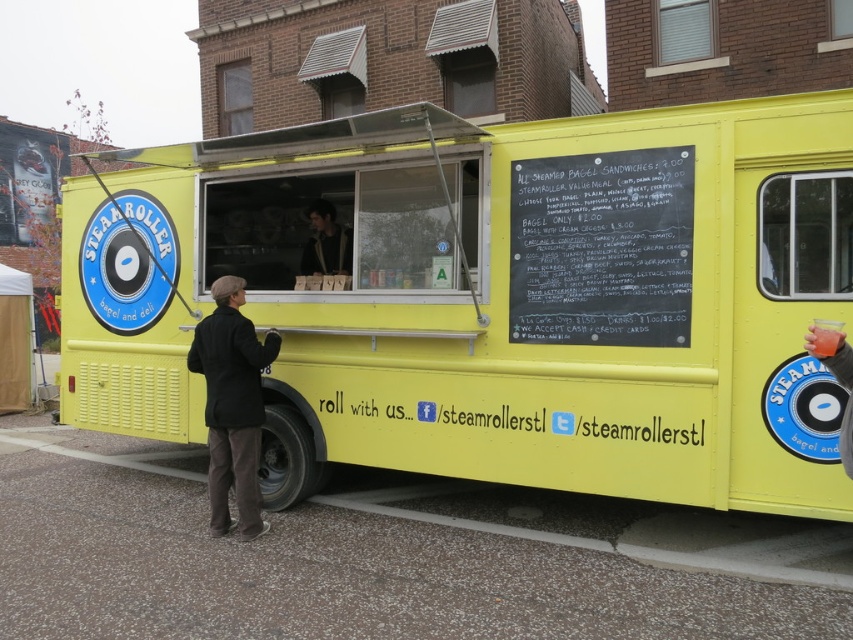
What do you see at coordinates (602, 248) in the screenshot? This screenshot has width=853, height=640. I see `black chalkboard at upper center` at bounding box center [602, 248].

Is black chalkboard at upper center below dark brown leather jacket at center?

Indeed, black chalkboard at upper center is positioned under dark brown leather jacket at center.

What do you see at coordinates (602, 248) in the screenshot? The image size is (853, 640). I see `black chalkboard at upper center` at bounding box center [602, 248].

At what (x,y) coordinates should I click in order to perform the action: click on black chalkboard at upper center. Please return your answer as a coordinate pair (x, y). The height and width of the screenshot is (640, 853). Looking at the image, I should click on (602, 248).

Is yellow matte food truck at center taller than black chalkboard at upper center?

Indeed, yellow matte food truck at center has a greater height compared to black chalkboard at upper center.

Is yellow matte food truck at center closer to the viewer compared to black chalkboard at upper center?

No, it is behind black chalkboard at upper center.

Is point (453, 282) farther from viewer compared to point (589, 154)?

Yes, it is behind point (589, 154).

The width and height of the screenshot is (853, 640). What are the coordinates of `yellow matte food truck at center` in the screenshot? It's located at pyautogui.click(x=492, y=298).

Can you confirm if yellow matte food truck at center is bigger than dark brown leather jacket at center?

Correct, yellow matte food truck at center is larger in size than dark brown leather jacket at center.

I want to click on yellow matte food truck at center, so click(x=492, y=298).

You are a GUI agent. You are given a task and a screenshot of the screen. Output one action in this format:
    pyautogui.click(x=<x>, y=<y>)
    Task: Click on the yellow matte food truck at center
    
    Given the screenshot: What is the action you would take?
    pyautogui.click(x=492, y=298)